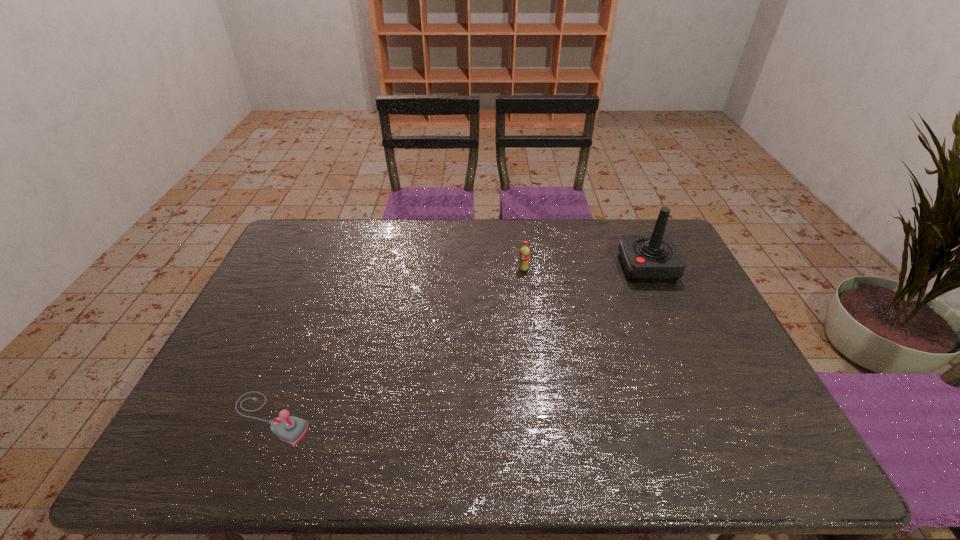
This screenshot has width=960, height=540. What are the coordinates of `the farther joystick` in the screenshot? It's located at (646, 258).

What are the coordinates of `the right joystick` in the screenshot? It's located at click(646, 258).

Find the location of a particular element. the second tallest object is located at coordinates (524, 255).

You are a GUI agent. You are given a task and a screenshot of the screen. Output one action in this format:
    pyautogui.click(x=<x>, y=<y>)
    Task: Click on the soda
    This screenshot has height=540, width=960.
    Given the screenshot: What is the action you would take?
    pyautogui.click(x=524, y=255)

Identify the location of the nearer joystick. This screenshot has width=960, height=540. (291, 429).

Locate an element on the screen. the nearest object is located at coordinates (291, 429).

Where is `blank area located on the front-facing side of the rightmost object`? blank area located on the front-facing side of the rightmost object is located at coordinates (597, 268).

I want to click on free spot located 0.380m on the front-facing side of the rightmost object, so point(506,268).

This screenshot has width=960, height=540. In order to click on vacant space situated 0.080m on the front-facing side of the rightmost object in this screenshot , I will do `click(597, 268)`.

Locate an element on the screen. The image size is (960, 540). free region located on the left of the second shortest object is located at coordinates pyautogui.click(x=464, y=269).